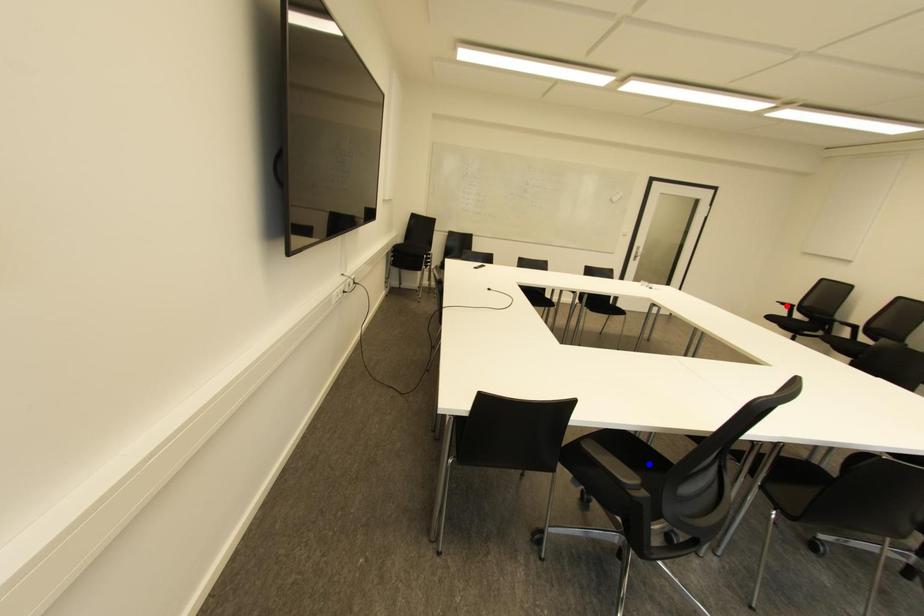
Question: Which of the two points in the image is closer to the camera?

Choices:
 (A) Blue point is closer.
 (B) Red point is closer.

Answer: (A)